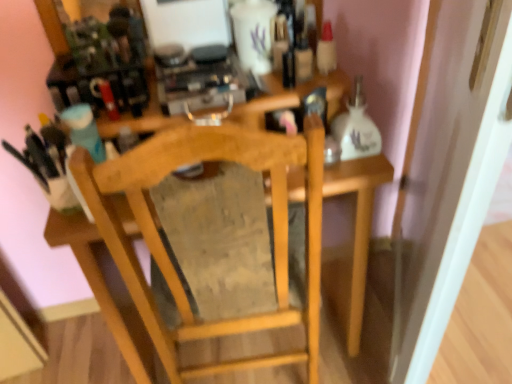
Question: From the image's perspective, would you say white glossy door at right is shown under wooden chair at center?

Choices:
 (A) yes
 (B) no

Answer: (B)

Question: From a real-world perspective, is white glossy door at right on wooden chair at center?

Choices:
 (A) yes
 (B) no

Answer: (A)

Question: From a real-world perspective, is white glossy door at right positioned under wooden chair at center based on gravity?

Choices:
 (A) no
 (B) yes

Answer: (A)

Question: Is white glossy door at right aimed at wooden chair at center?

Choices:
 (A) no
 (B) yes

Answer: (B)

Question: Is white glossy door at right surrounding wooden chair at center?

Choices:
 (A) no
 (B) yes

Answer: (A)

Question: Considering the relative sizes of white glossy door at right and wooden chair at center in the image provided, is white glossy door at right wider than wooden chair at center?

Choices:
 (A) no
 (B) yes

Answer: (A)

Question: Can you confirm if wooden chair at center is bigger than white glossy door at right?

Choices:
 (A) yes
 (B) no

Answer: (A)

Question: From a real-world perspective, is wooden chair at center located beneath white glossy door at right?

Choices:
 (A) no
 (B) yes

Answer: (B)

Question: Is wooden chair at center positioned with its back to white glossy door at right?

Choices:
 (A) yes
 (B) no

Answer: (B)

Question: Does wooden chair at center have a lesser height compared to white glossy door at right?

Choices:
 (A) yes
 (B) no

Answer: (A)

Question: Can you see wooden chair at center touching white glossy door at right?

Choices:
 (A) yes
 (B) no

Answer: (B)

Question: Is wooden chair at center further to camera compared to white glossy door at right?

Choices:
 (A) no
 (B) yes

Answer: (B)

Question: Considering their positions, is wooden chair at center located in front of or behind white glossy door at right?

Choices:
 (A) behind
 (B) front

Answer: (A)